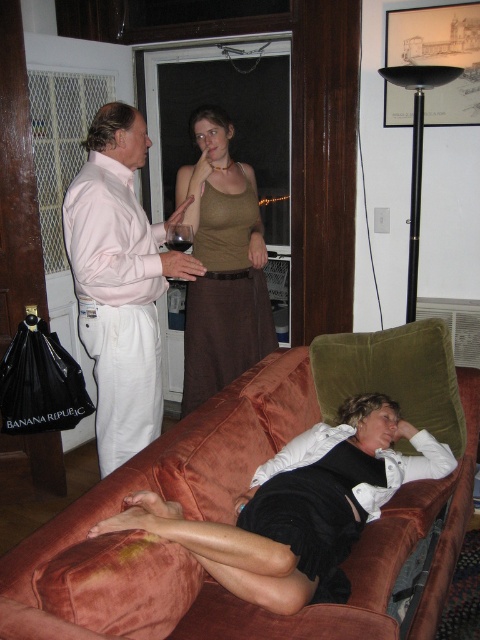
You are standing in the living room and want to place a small table exactly at the point with coordinates point (184, 493). If the table requires at least 1.5 meters of space from the camera to avoid being too close, will this placement work?

The distance of point (184, 493) from camera is 1.71 meters, so yes, placing the table there will be okay since it meets the minimum required distance of 1.5 meters.

You are planning to place a new decorative pillow on the velvet brown couch at lower center and the matte green tank top at upper center. Considering their sizes, which object would allow the pillow to fit more comfortably?

The velvet brown couch at lower center has a larger size compared to the matte green tank top at upper center, so the pillow would fit more comfortably on the velvet brown couch at lower center.

You are standing in the living room and want to place a small plant on the velvet brown couch at lower center. However, there is already a matte green tank top at upper center above it. Can the plant be placed on the couch without moving the tank top?

The velvet brown couch at lower center is positioned under the matte green tank top at upper center, so placing the plant on the couch would not interfere with the tank top as it is above it.